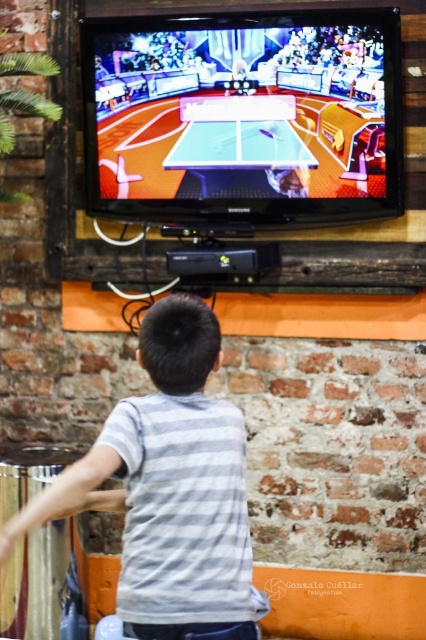
Based on the photo, you are a drone operator who needs to place a small drone at a specific point in the room. The point is located at coordinates point (308, 116). The drone has a maximum flight range of 8 feet. Can the drone reach the point from your current position?

The distance of point (308, 116) from the camera is 8.52 feet, which exceeds the drone maximum flight range of 8 feet. Therefore, the drone cannot reach the point from your current position.

You are a character in a video game and need to move from point A to point B. The coordinates for point A are point A at point (163, 51) and point B are point B at point (149, 612). According to the scene, which point is closer to you?

Point A at point (163, 51) is closer to you than point B at point (149, 612) because it is further to the viewer.